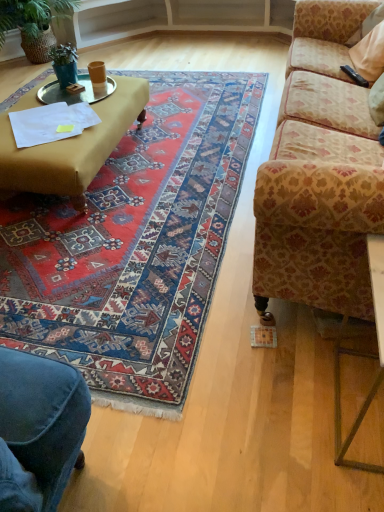
This screenshot has height=512, width=384. I want to click on vacant area situated below metallic silver tray at upper left (from a real-world perspective), so click(x=70, y=99).